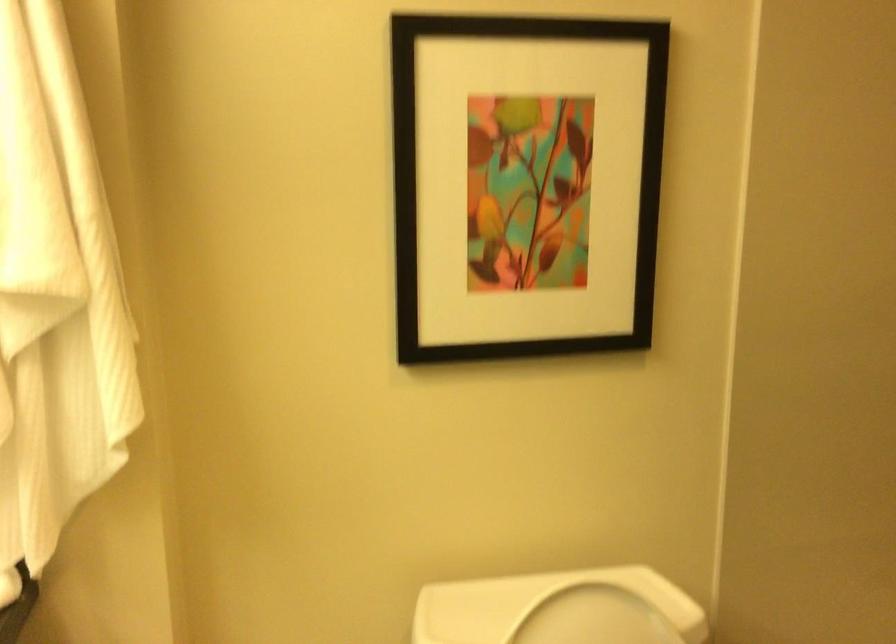
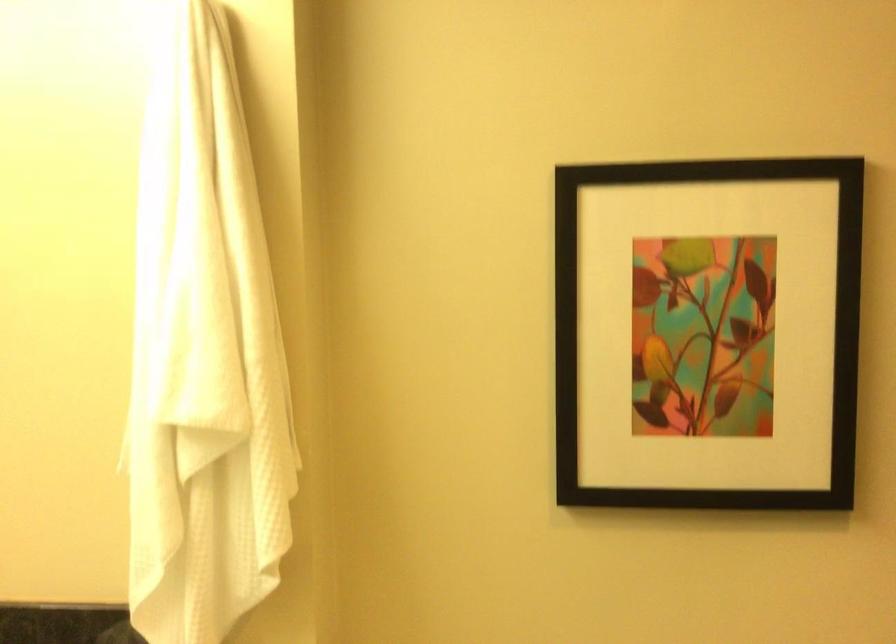
Question: Based on the continuous images, in which direction is the camera rotating? Reply with the corresponding letter.

Choices:
 (A) Left
 (B) Right
 (C) Up
 (D) Down

Answer: (A)